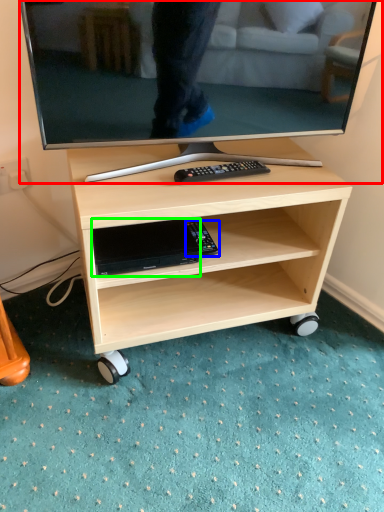
Question: Considering the real-world distances, which object is farthest from television (highlighted by a red box)? equipment (highlighted by a blue box) or gadget (highlighted by a green box)?

Choices:
 (A) equipment
 (B) gadget

Answer: (A)